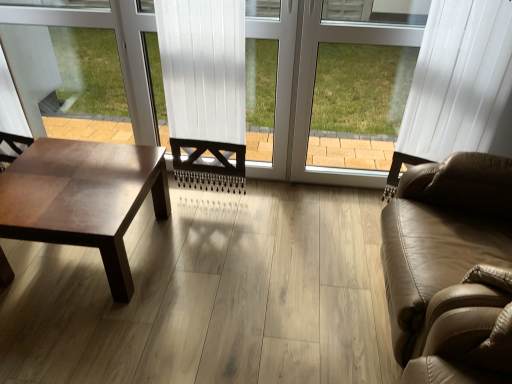
You are a GUI agent. You are given a task and a screenshot of the screen. Output one action in this format:
    pyautogui.click(x=<x>, y=<y>)
    Task: Click on the free space in front of shiny brown wood coffee table at left
    
    Given the screenshot: What is the action you would take?
    pyautogui.click(x=83, y=336)